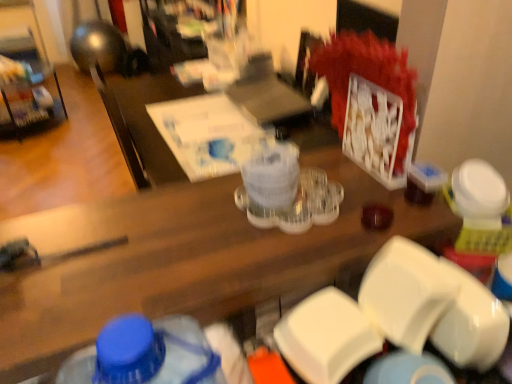
Image resolution: width=512 pixels, height=384 pixels. What do you see at coordinates (187, 260) in the screenshot? I see `wooden desk at center` at bounding box center [187, 260].

This screenshot has width=512, height=384. Identify the location of wooden desk at center. (187, 260).

The width and height of the screenshot is (512, 384). What are the coordinates of `wooden desk at center` in the screenshot? It's located at (187, 260).